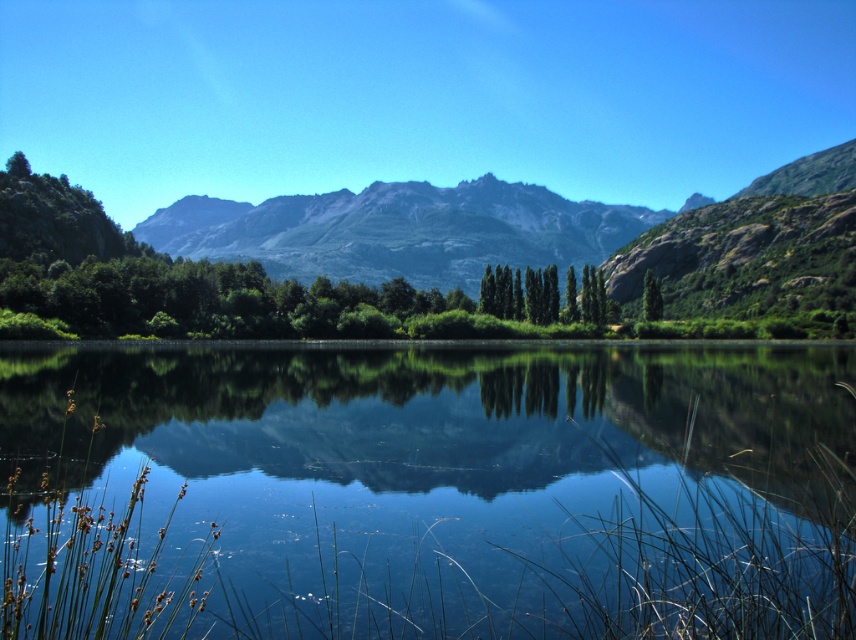
You are standing at the edge of the water and see the green smooth trees at center and the green glossy tree at center. Which one is closer to the water?

The green smooth trees at center are closer to the water because they are located below the green glossy tree at center, meaning they are positioned lower in the scene, which corresponds to being nearer to the water edge.

You are an environmental scientist assessing the biodiversity of this area. You notice two types of trees at the center of the image. Which tree type, the green smooth trees at center or the green glossy tree at center, might contribute more to the habitat diversity due to their physical size?

The green smooth trees at center might be wider than the green glossy tree at center, so they could provide more canopy cover and nesting opportunities, thus contributing more to habitat diversity.

You are an outdoor enthusiast planning a hiking route. You see the green rocky mountain range at center and the green smooth trees at center in the distance. Which of these two landmarks is positioned higher in the scene?

The green rocky mountain range at center is positioned higher than the green smooth trees at center in the scene.